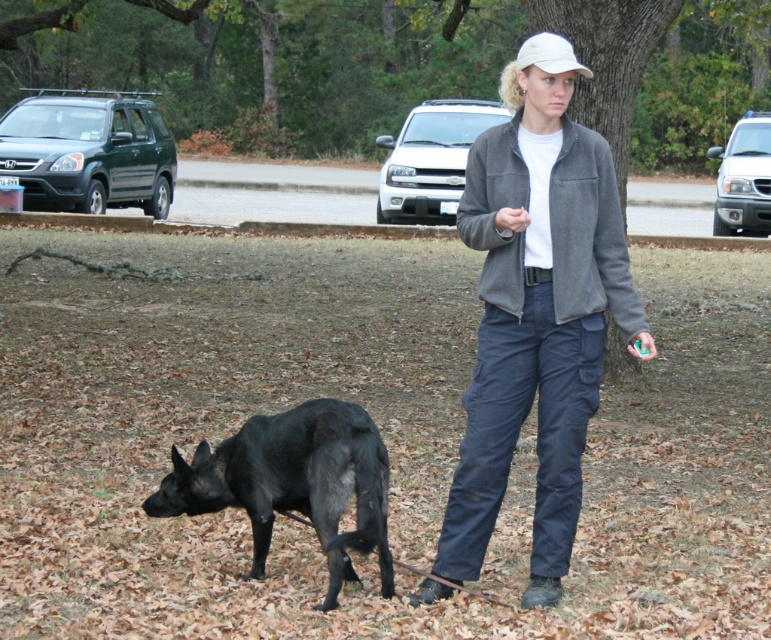
Find the location of `black matte dog at lower left`. black matte dog at lower left is located at coordinates (291, 483).

Based on the photo, is black matte dog at lower left above white matte baseball cap at upper center?

Incorrect, black matte dog at lower left is not positioned above white matte baseball cap at upper center.

Identify the location of black matte dog at lower left. (291, 483).

Is gray fleece jacket at center wider than black matte dog at lower left?

In fact, gray fleece jacket at center might be narrower than black matte dog at lower left.

Does gray fleece jacket at center have a smaller size compared to black matte dog at lower left?

Actually, gray fleece jacket at center might be larger than black matte dog at lower left.

Does point (480, 214) come behind point (386, 584)?

No, it is in front of (386, 584).

What are the coordinates of `gray fleece jacket at center` in the screenshot? It's located at (534, 323).

Find the location of `gray fleece jacket at center`. gray fleece jacket at center is located at coordinates (534, 323).

Who is shorter, gray fleece jacket at center or white matte baseball cap at upper center?

gray fleece jacket at center is shorter.

Is point (564, 561) positioned in front of point (554, 60)?

No, (564, 561) is further to viewer.

Where is `gray fleece jacket at center`? The image size is (771, 640). gray fleece jacket at center is located at coordinates (534, 323).